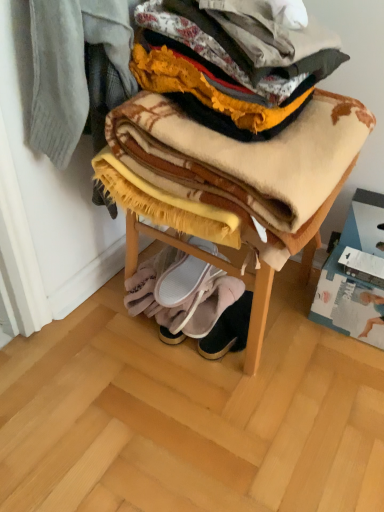
Locate an element on the screen. The image size is (384, 512). free spot in front of soft yellow fleece blanket at lower center, which is the first blanket from back to front is located at coordinates (186, 367).